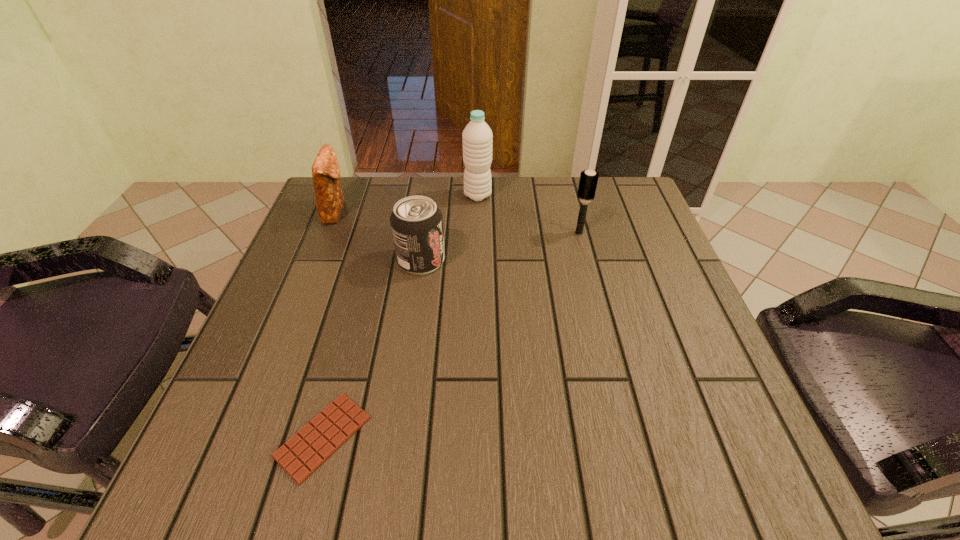
The width and height of the screenshot is (960, 540). Identify the location of free space between the water bottle and the shortest object. (400, 316).

The image size is (960, 540). Find the location of `vacant area that lies between the hairbrush and the soda can`. vacant area that lies between the hairbrush and the soda can is located at coordinates (500, 247).

The width and height of the screenshot is (960, 540). In order to click on free space that is in between the nearest object and the third farthest object in this screenshot , I will do `click(451, 335)`.

Image resolution: width=960 pixels, height=540 pixels. In order to click on free space that is in between the second object from right to left and the nearest object in this screenshot , I will do `click(400, 316)`.

Image resolution: width=960 pixels, height=540 pixels. What are the coordinates of `vacant space that is in between the third nearest object and the nearest object` in the screenshot? It's located at (451, 335).

Locate an element on the screen. This screenshot has height=540, width=960. free space between the candy bar and the water bottle is located at coordinates (400, 316).

I want to click on free space between the hairbrush and the tallest object, so click(528, 214).

Find the location of a particular element. This screenshot has width=960, height=540. object identified as the fourth closest to the candy bar is located at coordinates (477, 136).

Where is `object that is the third nearest to the second nearest object`? object that is the third nearest to the second nearest object is located at coordinates (317, 441).

At what (x,y) coordinates should I click in order to perform the action: click on free region that satisfies the following two spatial constraints: 1. on the back side of the shortest object; 2. on the right side of the second nearest object. Please return your answer as a coordinate pair (x, y). The image size is (960, 540). Looking at the image, I should click on (371, 260).